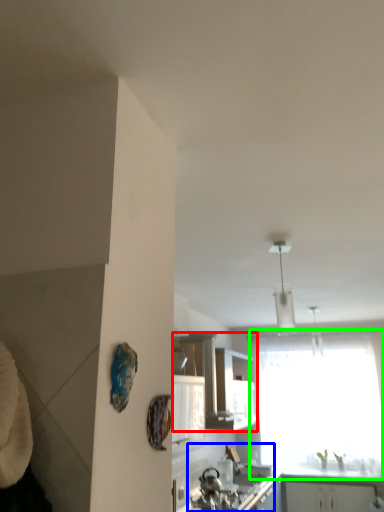
Question: Which object is positioned closest to cabinetry (highlighted by a red box)? Select from sink (highlighted by a blue box) and window (highlighted by a green box).

Choices:
 (A) sink
 (B) window

Answer: (A)